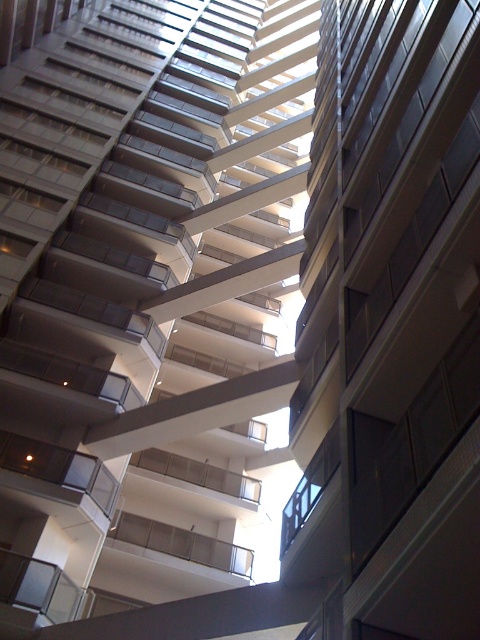
Looking up at the modern building from below, you notice two central balconies. Which one is positioned to the left when comparing the metallic silver balcony at center and the white glass balcony at center?

The metallic silver balcony at center is positioned to the left of the white glass balcony at center.

You are standing directly under the building looking up. There are two points marked on the building facade, one at point coordinates point (240, 556) and the other at point coordinates point (39, 360). Which point is closer to your eyes?

Point (39, 360) is closer to your eyes because it is nearer to the bottom of the building where you are standing, while point (240, 556) is higher up and further away.